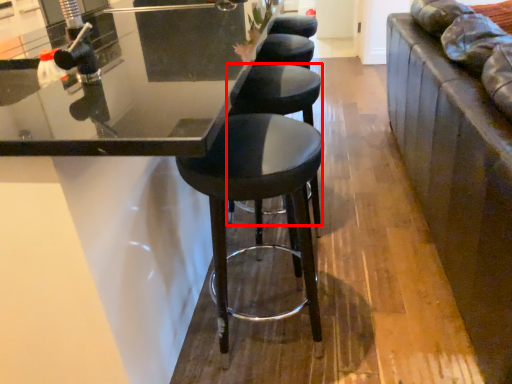
Question: In this image, where is stool (annotated by the red box) located relative to stool?

Choices:
 (A) left
 (B) right

Answer: (B)